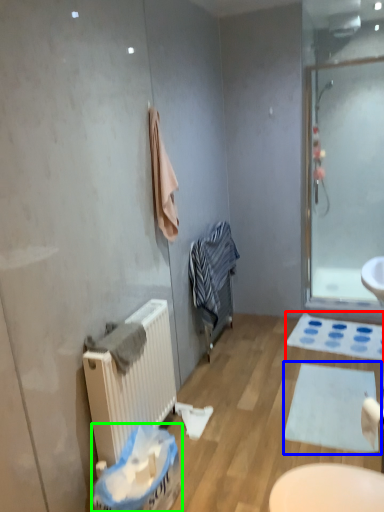
Question: Estimate the real-world distances between objects in this image. Which object is farther from bath mat (highlighted by a red box), bath mat (highlighted by a blue box) or laundry basket (highlighted by a green box)?

Choices:
 (A) bath mat
 (B) laundry basket

Answer: (B)